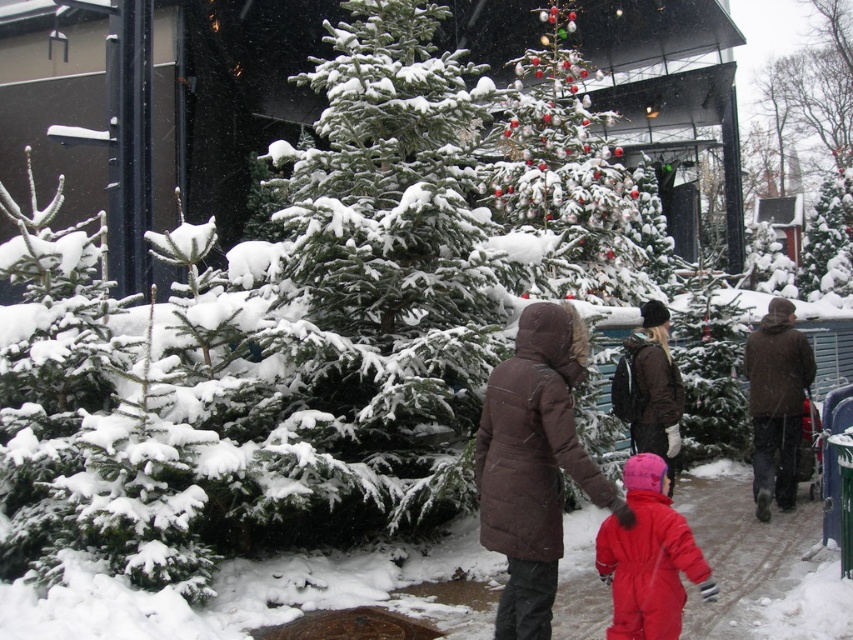
You are standing at the point labeled as point [270,344] in the snowy outdoor scene. You want to move to the Christmas tree lot entrance, which is directly behind you. However, there is a large snowdrift in your path. Can you step over it?

The point labeled as point [270,344] is 6.77 meters away from the viewer. Since the snowdrift is in your path, you need to determine if you can step over it. However, the description does not provide information about the snowdrift height or your ability to step over it. Therefore, it is impossible to answer based on the given information.